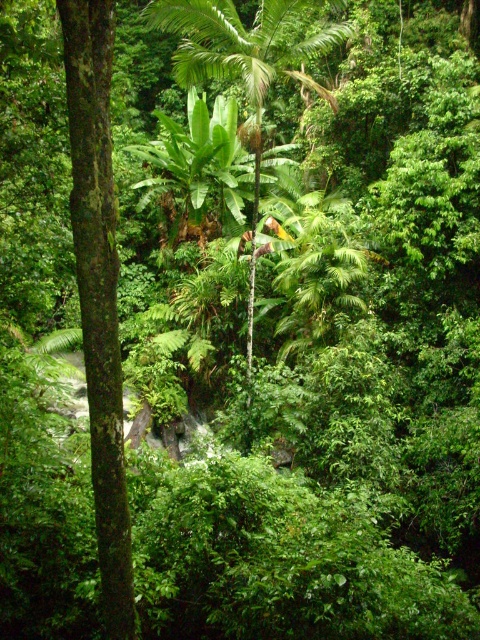
Question: Can you confirm if green rough bark tree at left is positioned to the left of green leafy palm tree at center?

Choices:
 (A) yes
 (B) no

Answer: (A)

Question: Does green rough bark tree at left have a larger size compared to green leafy palm tree at center?

Choices:
 (A) no
 (B) yes

Answer: (A)

Question: Is green rough bark tree at left smaller than green leafy palm tree at center?

Choices:
 (A) yes
 (B) no

Answer: (A)